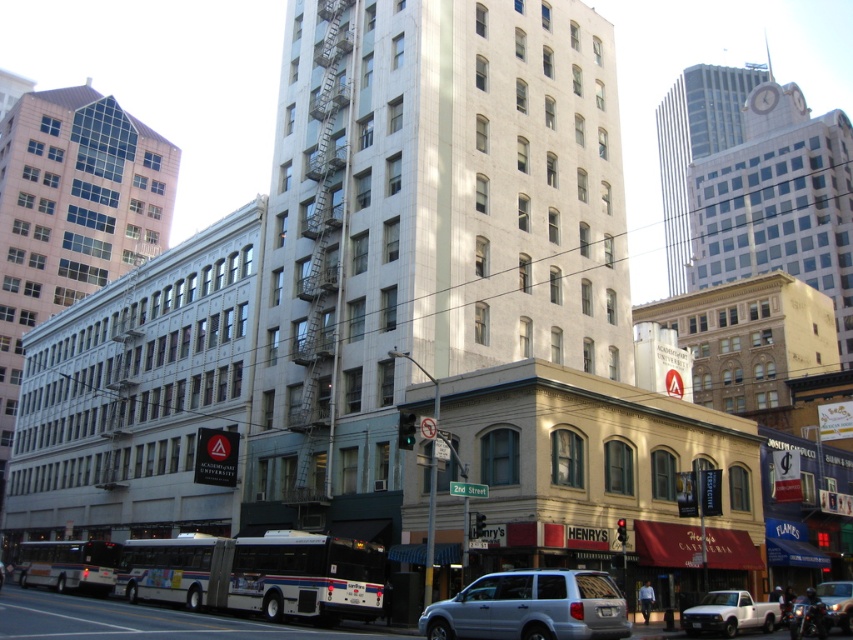
You are standing at point A at point (569, 570) and want to reach point B, which is 45.49 meters away. The path between them is clear. Can you walk directly from point A to point B without any obstacles?

Yes, you can walk directly from point A at point (569, 570) to point B because the path between them is clear and there are no obstacles mentioned in the scene description.